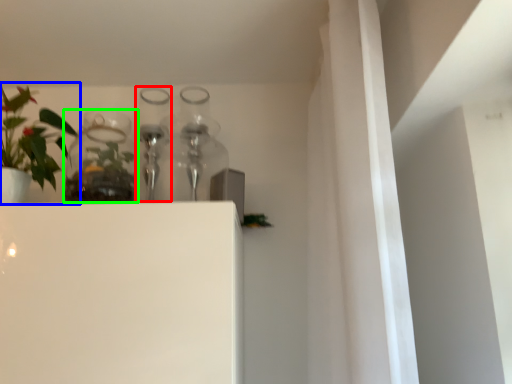
Question: Which is farther away from bottle (highlighted by a red box)? houseplant (highlighted by a blue box) or glass vase (highlighted by a green box)?

Choices:
 (A) houseplant
 (B) glass vase

Answer: (A)